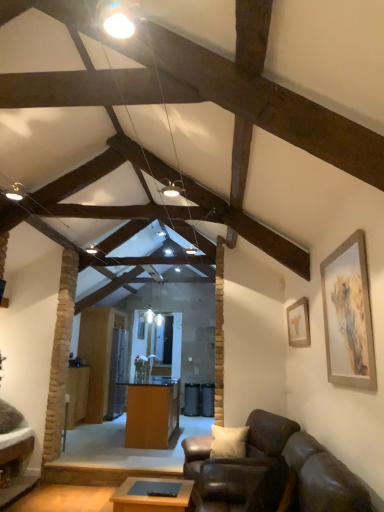
Identify the location of leather couch at lower right. The image size is (384, 512). (272, 473).

In order to click on wooden table at center, placed as the 2th table when sorted from left to right in this screenshot , I will do [x=151, y=496].

What do you see at coordinates (151, 496) in the screenshot? I see `wooden table at center, which is the 1th table from front to back` at bounding box center [151, 496].

How much space does wooden table at center, which is counted as the 1th table, starting from the back, occupy horizontally?

wooden table at center, which is counted as the 1th table, starting from the back, is 12.90 inches in width.

Identify the location of matte gold picture frame at upper right, the first picture frame viewed from the back. This screenshot has width=384, height=512. (298, 323).

What is the approximate width of silver metallic picture frame at right, the 1th picture frame from the left?

silver metallic picture frame at right, the 1th picture frame from the left, is 2.75 inches wide.

At what (x,y) coordinates should I click in order to perform the action: click on leather couch at lower right. Please return your answer as a coordinate pair (x, y). Looking at the image, I should click on (272, 473).

Identify the location of studio couch below the matte gold picture frame at upper right, the first picture frame viewed from the back (from the image's perspective). (272, 473).

From a real-world perspective, which object stands above the other?

matte gold picture frame at upper right, the second picture frame when ordered from left to right, is physically above.

Does leather couch at lower right have a lesser width compared to matte gold picture frame at upper right, the second picture frame when ordered from left to right?

In fact, leather couch at lower right might be wider than matte gold picture frame at upper right, the second picture frame when ordered from left to right.

Does leather couch at lower right have a larger size compared to matte gold picture frame at upper right, which is counted as the second picture frame, starting from the front?

Yes, leather couch at lower right is bigger than matte gold picture frame at upper right, which is counted as the second picture frame, starting from the front.

From a real-world perspective, is wooden table at center, which is the 1th table from front to back, located beneath matte gold picture frame at upper right, which is counted as the second picture frame, starting from the front?

Yes, from a real-world perspective, wooden table at center, which is the 1th table from front to back, is beneath matte gold picture frame at upper right, which is counted as the second picture frame, starting from the front.

Based on the photo, between wooden table at center, which is the 1th table from front to back, and matte gold picture frame at upper right, which is counted as the second picture frame, starting from the front, which one is positioned behind?

matte gold picture frame at upper right, which is counted as the second picture frame, starting from the front, is more distant.

Is wooden table at center, placed as the 2th table when sorted from left to right, turned away from matte gold picture frame at upper right, the first picture frame viewed from the back?

wooden table at center, placed as the 2th table when sorted from left to right, is not turned away from matte gold picture frame at upper right, the first picture frame viewed from the back.

Which of these two, wooden table at center, which is the 1th table from front to back, or matte gold picture frame at upper right, marked as the 1th picture frame in a right-to-left arrangement, is wider?

wooden table at center, which is the 1th table from front to back.

Is silver metallic picture frame at right, acting as the 2th picture frame starting from the back, far away from leather couch at lower right?

silver metallic picture frame at right, acting as the 2th picture frame starting from the back, is actually quite close to leather couch at lower right.

Is leather couch at lower right at the back of silver metallic picture frame at right, placed as the 2th picture frame when sorted from right to left?

No, leather couch at lower right is not at the back of silver metallic picture frame at right, placed as the 2th picture frame when sorted from right to left.

From the image's perspective, is silver metallic picture frame at right, the 1th picture frame from the left, positioned above or below leather couch at lower right?

Based on their image positions, silver metallic picture frame at right, the 1th picture frame from the left, is located above leather couch at lower right.

Considering the relative positions of silver metallic picture frame at right, placed as the 2th picture frame when sorted from right to left, and wooden table at center, which is counted as the 1th table, starting from the back, in the image provided, is silver metallic picture frame at right, placed as the 2th picture frame when sorted from right to left, to the right of wooden table at center, which is counted as the 1th table, starting from the back, from the viewer's perspective?

Indeed, silver metallic picture frame at right, placed as the 2th picture frame when sorted from right to left, is positioned on the right side of wooden table at center, which is counted as the 1th table, starting from the back.

Can you confirm if silver metallic picture frame at right, the 1th picture frame from the left, is shorter than wooden table at center, marked as the second table in a front-to-back arrangement?

Yes, silver metallic picture frame at right, the 1th picture frame from the left, is shorter than wooden table at center, marked as the second table in a front-to-back arrangement.

Which of these two, silver metallic picture frame at right, placed as the 2th picture frame when sorted from right to left, or wooden table at center, marked as the second table in a front-to-back arrangement, is smaller?

silver metallic picture frame at right, placed as the 2th picture frame when sorted from right to left, is smaller.

From the image's perspective, is silver metallic picture frame at right, acting as the 2th picture frame starting from the back, located above or below wooden table at center, the 2th table from the right?

Clearly, from the image's perspective, silver metallic picture frame at right, acting as the 2th picture frame starting from the back, is above wooden table at center, the 2th table from the right.

Between point (306, 311) and point (72, 426), which one is positioned in front?

The point (306, 311) is closer to the camera.

Is matte gold picture frame at upper right, which is counted as the second picture frame, starting from the front, oriented towards wooden table at center, which is counted as the 1th table, starting from the back?

No, matte gold picture frame at upper right, which is counted as the second picture frame, starting from the front, is not facing towards wooden table at center, which is counted as the 1th table, starting from the back.

Are matte gold picture frame at upper right, the first picture frame viewed from the back, and wooden table at center, marked as the second table in a front-to-back arrangement, located far from each other?

Answer: Indeed, matte gold picture frame at upper right, the first picture frame viewed from the back, is not near wooden table at center, marked as the second table in a front-to-back arrangement.

Considering the relative positions of orange wood desk at center and matte gold picture frame at upper right, which is counted as the second picture frame, starting from the front, in the image provided, is orange wood desk at center behind matte gold picture frame at upper right, which is counted as the second picture frame, starting from the front,?

Yes, it is behind matte gold picture frame at upper right, which is counted as the second picture frame, starting from the front.

Is orange wood desk at center beside matte gold picture frame at upper right, the first picture frame viewed from the back?

No, orange wood desk at center is not touching matte gold picture frame at upper right, the first picture frame viewed from the back.

From a real-world perspective, is orange wood desk at center on matte gold picture frame at upper right, the second picture frame when ordered from left to right?

Actually, orange wood desk at center is physically below matte gold picture frame at upper right, the second picture frame when ordered from left to right, in the real world.

Based on their positions, is silver metallic picture frame at right, placed as the 2th picture frame when sorted from right to left, located to the left or right of orange wood desk at center?

In the image, silver metallic picture frame at right, placed as the 2th picture frame when sorted from right to left, appears on the right side of orange wood desk at center.

Which object is further away from the camera, silver metallic picture frame at right, placed as the 2th picture frame when sorted from right to left, or orange wood desk at center?

orange wood desk at center is more distant.

From a real-world perspective, is silver metallic picture frame at right, placed as the 2th picture frame when sorted from right to left, below orange wood desk at center?

No.

Find the location of a particular element. studio couch below the matte gold picture frame at upper right, the first picture frame viewed from the back (from the image's perspective) is located at coordinates (272, 473).

This screenshot has height=512, width=384. What are the coordinates of `the 2nd table below the matte gold picture frame at upper right, marked as the 1th picture frame in a right-to-left arrangement (from a real-world perspective)` in the screenshot? It's located at coord(151,496).

When comparing their distances from leather couch at lower right, does silver metallic picture frame at right, acting as the 2th picture frame starting from the back, or wooden table at center, placed as the 2th table when sorted from left to right, seem closer?

The object closer to leather couch at lower right is wooden table at center, placed as the 2th table when sorted from left to right.

From the image, which object appears to be farther from silver metallic picture frame at right, acting as the 2th picture frame starting from the back, orange wood desk at center or wooden table at center, which is the 1th table from front to back?

Among the two, orange wood desk at center is located further to silver metallic picture frame at right, acting as the 2th picture frame starting from the back.

From the image, which object appears to be nearer to orange wood desk at center, wooden table at center, the second table in the back-to-front sequence, or leather couch at lower right?

leather couch at lower right is positioned closer to the anchor orange wood desk at center.

When comparing their distances from wooden table at center, the first table from the right, does silver metallic picture frame at right, acting as the 2th picture frame starting from the back, or wooden table at center, which is counted as the 1th table, starting from the back, seem further?

The object further to wooden table at center, the first table from the right, is wooden table at center, which is counted as the 1th table, starting from the back.

Based on their spatial positions, is silver metallic picture frame at right, placed as the 2th picture frame when sorted from right to left, or matte gold picture frame at upper right, marked as the 1th picture frame in a right-to-left arrangement, further from orange wood desk at center?

silver metallic picture frame at right, placed as the 2th picture frame when sorted from right to left, is further to orange wood desk at center.

From the picture: Looking at the image, which one is located closer to wooden table at center, the second table in the back-to-front sequence, wooden table at center, marked as the second table in a front-to-back arrangement, or matte gold picture frame at upper right, the second picture frame when ordered from left to right?

The object closer to wooden table at center, the second table in the back-to-front sequence, is matte gold picture frame at upper right, the second picture frame when ordered from left to right.

Estimate the real-world distances between objects in this image. Which object is further from matte gold picture frame at upper right, the second picture frame when ordered from left to right, leather couch at lower right or wooden table at center, the second table in the back-to-front sequence?

Based on the image, wooden table at center, the second table in the back-to-front sequence, appears to be further to matte gold picture frame at upper right, the second picture frame when ordered from left to right.

When comparing their distances from leather couch at lower right, does wooden table at center, which is the 1th table from front to back, or wooden table at center, the 2th table from the right, seem further?

wooden table at center, the 2th table from the right, is positioned further to the anchor leather couch at lower right.

Find the location of `table between leather couch at lower right and orange wood desk at center from front to back`. table between leather couch at lower right and orange wood desk at center from front to back is located at coordinates (151, 496).

I want to click on picture frame between leather couch at lower right and matte gold picture frame at upper right, marked as the 1th picture frame in a right-to-left arrangement, from front to back, so click(348, 316).

Where is `table located between silver metallic picture frame at right, which appears as the 1th picture frame when viewed from the front, and orange wood desk at center in the depth direction`? table located between silver metallic picture frame at right, which appears as the 1th picture frame when viewed from the front, and orange wood desk at center in the depth direction is located at coordinates tap(151, 496).

Identify the location of table between leather couch at lower right and wooden table at center, the 2th table from the right, in the front-back direction. This screenshot has height=512, width=384. (151, 496).